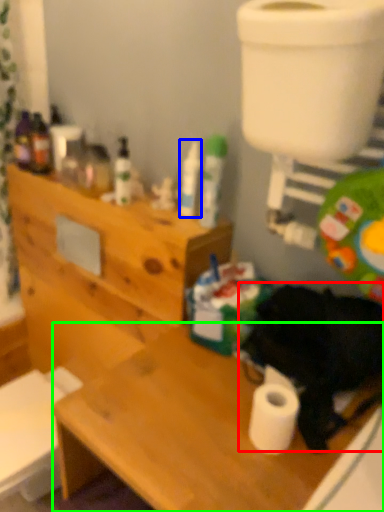
Question: Based on their relative distances, which object is nearer to animal (highlighted by a red box)? Choose from toiletry (highlighted by a blue box) and desk (highlighted by a green box).

Choices:
 (A) toiletry
 (B) desk

Answer: (B)